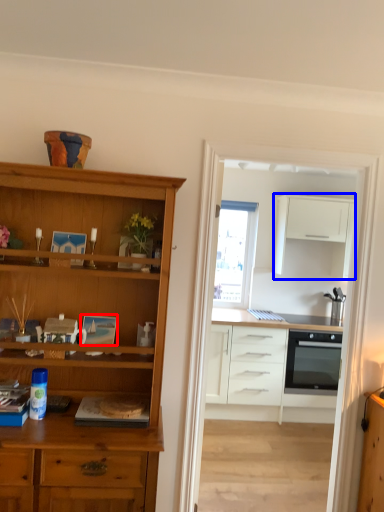
Question: Which of the following is the closest to the observer, picture frame (highlighted by a red box) or cabinetry (highlighted by a blue box)?

Choices:
 (A) picture frame
 (B) cabinetry

Answer: (A)